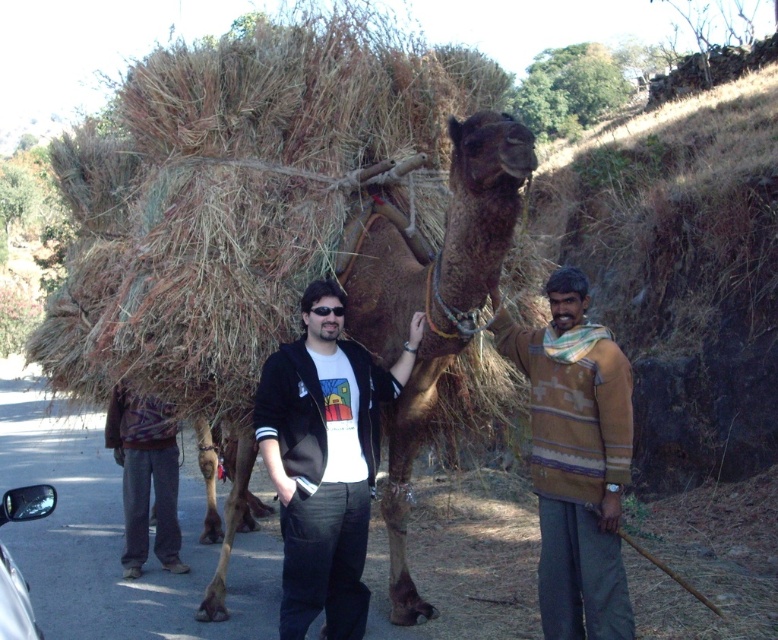
You are a photographer trying to capture the exact location of the black cotton jacket at center in this rural scene. According to the coordinates provided, where would you focus your camera lens to ensure the jacket is centered in the frame?

To center the black cotton jacket at center in the frame, focus your camera lens on the coordinates point at (324, 460).

You are a photographer standing at the edge of the road. You want to take a picture of the woolen sweater at center. Where should you position yourself to ensure the sweater is in the frame?

The woolen sweater at center is located at point (575, 460), so you should position yourself facing the center of the scene to capture it in the frame.